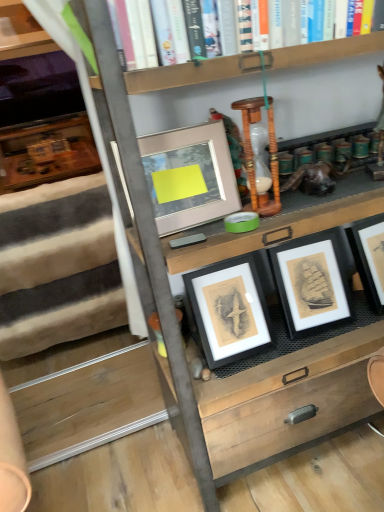
Question: Is matte black picture frame at center, which is the third picture frame in left-to-right order, taller or shorter than matte gray picture frame at upper center, the first picture frame in the left-to-right sequence?

Choices:
 (A) tall
 (B) short

Answer: (A)

Question: Is point (304, 317) positioned closer to the camera than point (170, 201)?

Choices:
 (A) closer
 (B) farther

Answer: (B)

Question: Which is nearer to the matte wood shelf at upper left?

Choices:
 (A) soft woolen rug at left
 (B) wooden table at center
 (C) wooden hourglass at center
 (D) matte black picture frame at center, which is the second picture frame from right to left
 (E) matte black picture frame at center, which is the third picture frame in left-to-right order

Answer: (A)

Question: Which is farther from the soft woolen rug at left?

Choices:
 (A) wooden table at center
 (B) wooden hourglass at center
 (C) matte gray picture frame at upper center, which ranks as the third picture frame in right-to-left order
 (D) matte wood shelf at upper left
 (E) matte black picture frame at center, which ranks as the 2th picture frame in left-to-right order

Answer: (D)